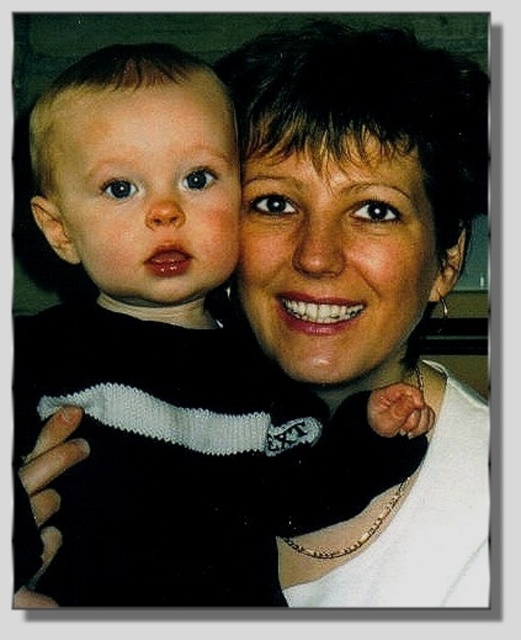
You are a photographer trying to locate the black knitted sweater at left in the image. According to the coordinates provided, where should you look to find it?

The black knitted sweater at left is located at point (x=169, y=362) in the image.

You are a photographer trying to decide where to place a small decorative pillow in the scene. The scene has a matte black sweater at center and a matte black baby at left. Which object should the pillow be placed closer to if you want it to appear proportionally balanced with the larger object?

The pillow should be placed closer to the matte black sweater at center because it is larger in size than the matte black baby at left, creating a balanced composition.

You are a photographer setting up for a family portrait. You notice the black knitted sweater at left and the matte black baby at left in the frame. Which object should you adjust to ensure the baby is centered in the shot without moving the baby?

The black knitted sweater at left is located below the matte black baby at left. To center the baby without moving them, adjust the camera angle slightly upward to focus on the baby while keeping the sweater in the frame.